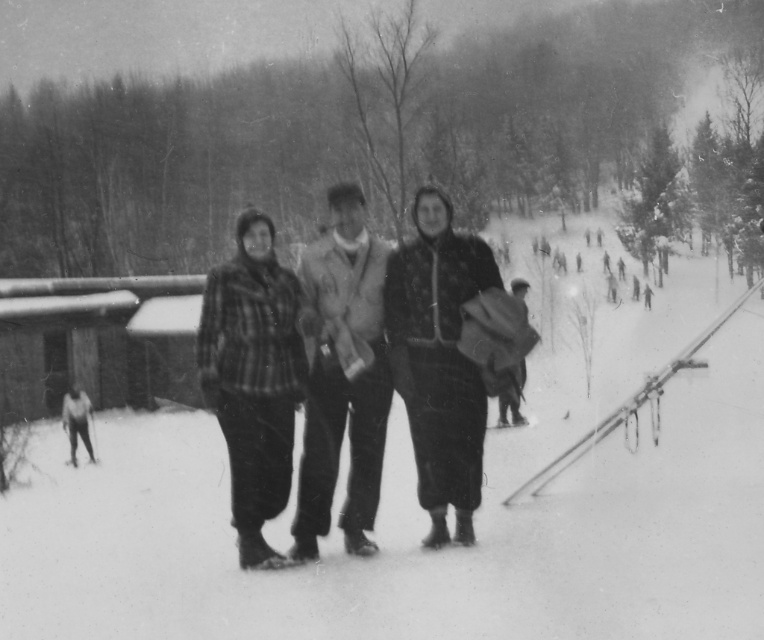
You are a photographer trying to capture a closeup shot of the plaid fabric jacket at center and the plaid fabric pants at center. Your camera has a maximum focus range of 1 meter. Can you focus on both objects simultaneously?

The plaid fabric jacket at center is 1.19 meters away from plaid fabric pants at center. Since the distance between them exceeds the camera maximum focus range of 1 meter, you cannot focus on both simultaneously.

You are a photographer trying to capture a clear shot of the white fluffy snow at center and the plaid fabric jacket at center. Which object is taller in the photo?

The white fluffy snow at center is taller than the plaid fabric jacket at center.